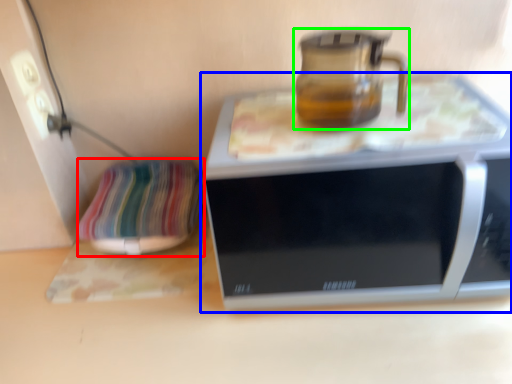
Question: Considering the real-world distances, which object is farthest from pillow (highlighted by a red box)? microwave oven (highlighted by a blue box) or jug (highlighted by a green box)?

Choices:
 (A) microwave oven
 (B) jug

Answer: (B)